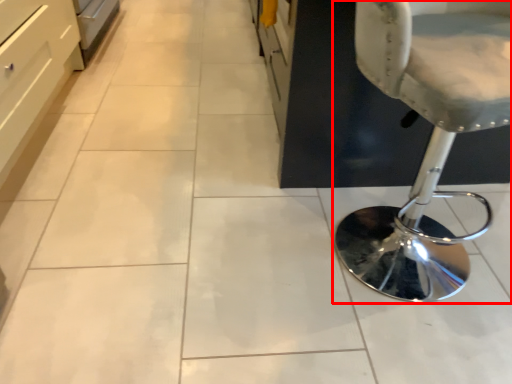
Question: In this image, where is chair (annotated by the red box) located relative to drawer?

Choices:
 (A) right
 (B) left

Answer: (A)